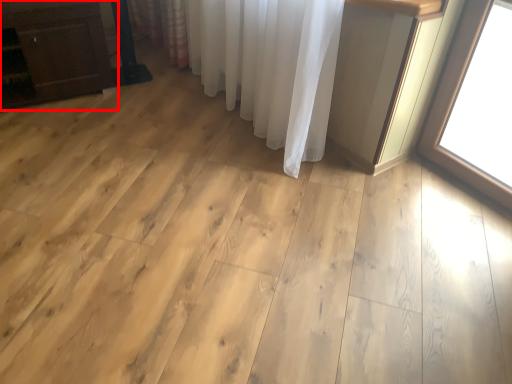
Question: From the image's perspective, what is the correct spatial relationship of furniture (annotated by the red box) in relation to curtain?

Choices:
 (A) above
 (B) below

Answer: (B)